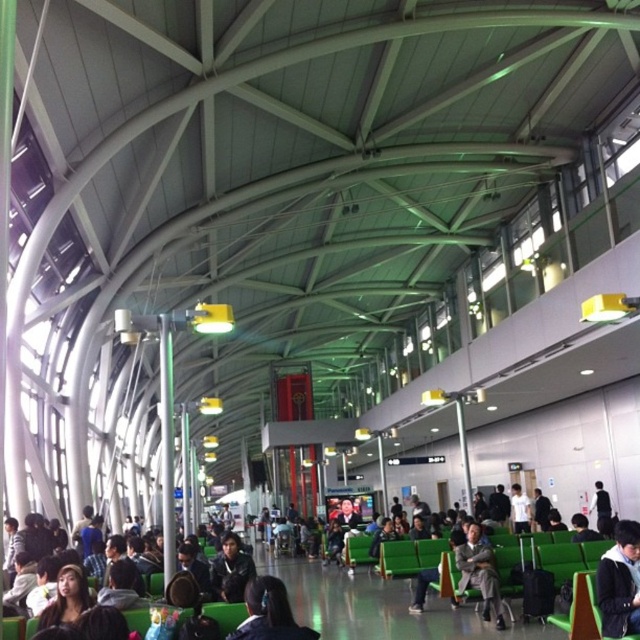
Can you confirm if dark hair at center is bigger than dark gray suit at center?

Incorrect, dark hair at center is not larger than dark gray suit at center.

Can you confirm if dark hair at center is positioned to the right of dark gray suit at center?

Incorrect, dark hair at center is not on the right side of dark gray suit at center.

Is point (260, 609) positioned before point (460, 576)?

Yes, point (260, 609) is in front of point (460, 576).

Where is `dark hair at center`? dark hair at center is located at coordinates (268, 612).

Can you confirm if dark gray suit at center is smaller than black leather jacket at center?

Yes, dark gray suit at center is smaller than black leather jacket at center.

The width and height of the screenshot is (640, 640). In order to click on dark gray suit at center in this screenshot , I will do `click(480, 572)`.

Find the location of `dark gray suit at center`. dark gray suit at center is located at coordinates (480, 572).

Does dark hair at center have a smaller size compared to black leather jacket at center?

Yes, dark hair at center is smaller than black leather jacket at center.

Which is in front, point (276, 611) or point (241, 596)?

Positioned in front is point (276, 611).

The image size is (640, 640). Find the location of `dark hair at center`. dark hair at center is located at coordinates (268, 612).